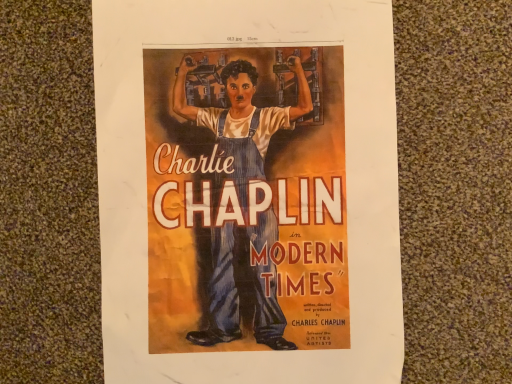
I want to click on free space above matte blue overalls at center (from a real-world perspective), so click(254, 214).